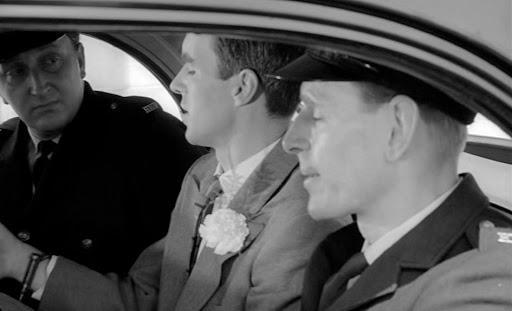
Locate an element on the screen. The image size is (512, 311). door is located at coordinates (457, 56), (170, 61).